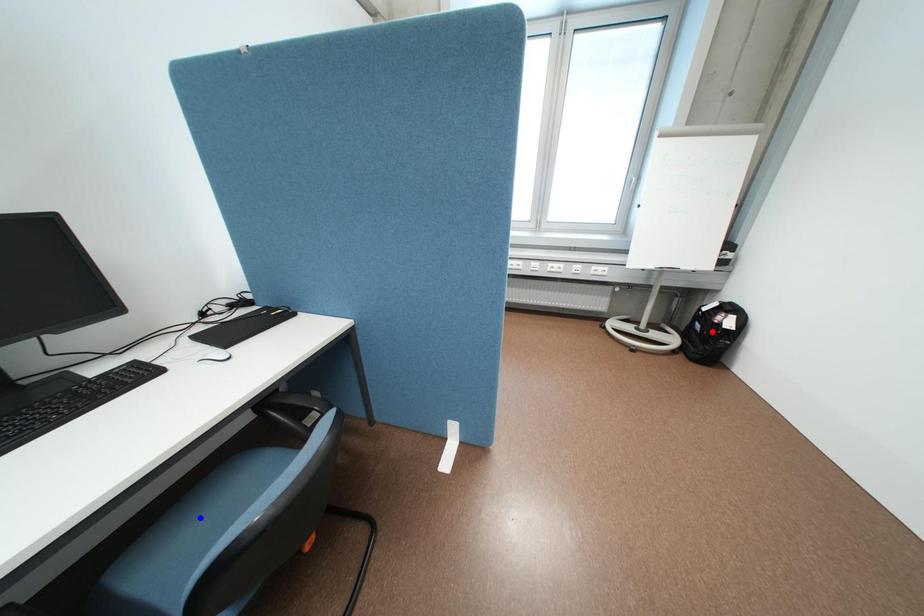
Question: Which of the two points in the image is closer to the camera?

Choices:
 (A) Blue point is closer.
 (B) Red point is closer.

Answer: (A)